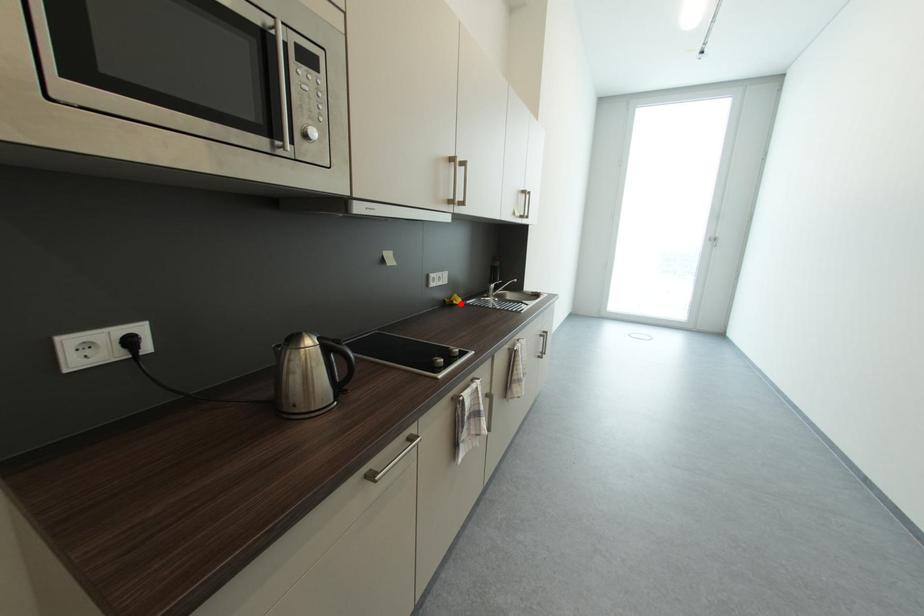
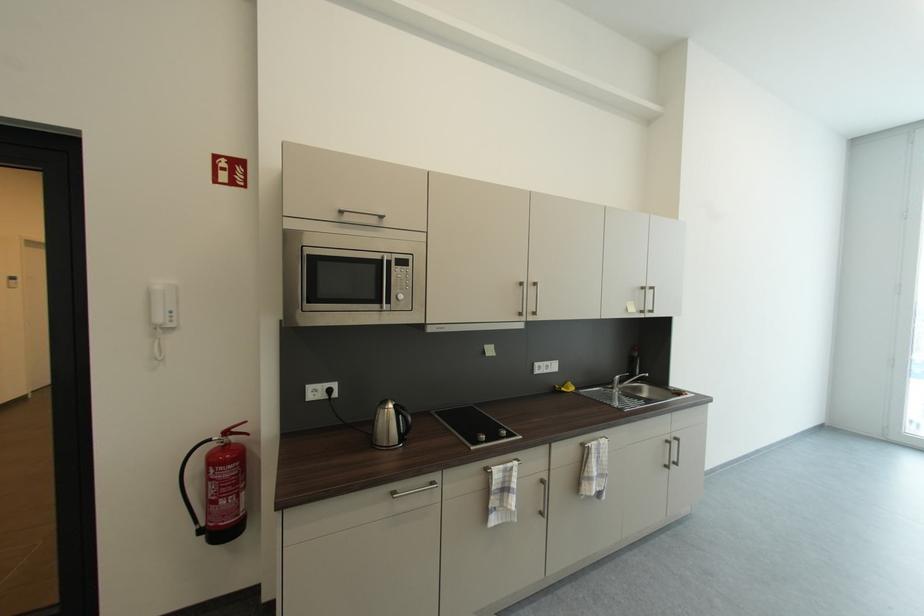
Where in the second image is the point corresponding to the highlighted location from the first image?

(569, 391)